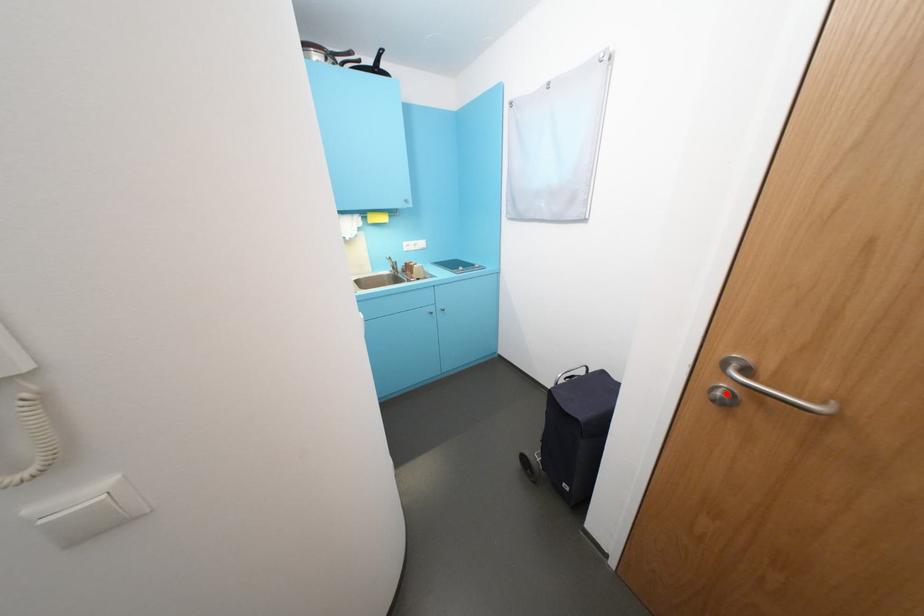
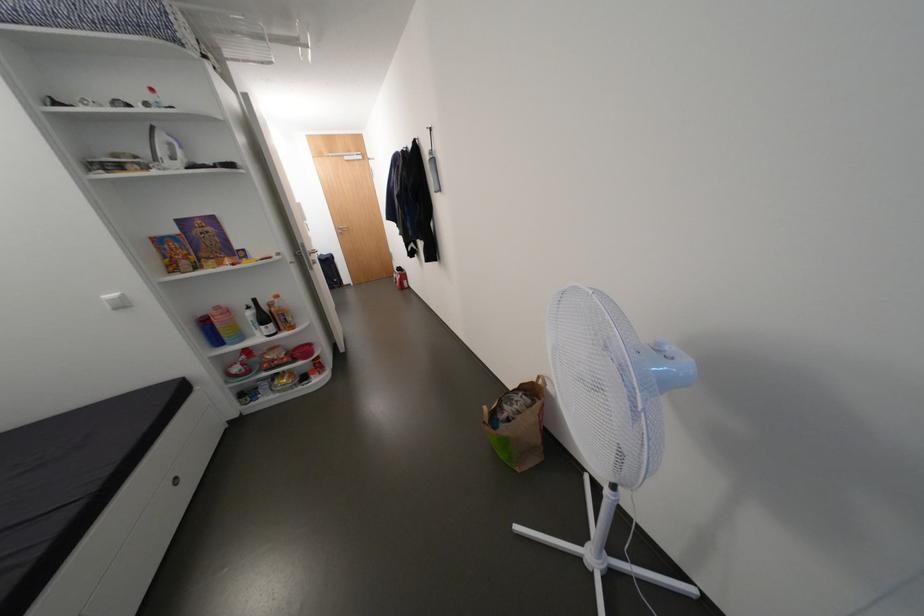
Question: I am providing you with two images of the same scene from different viewpoints. Given a red point in image1, look at the same physical point in image2. Is it:

Choices:
 (A) Closer to the viewpoint
 (B) Farther from the viewpoint

Answer: (A)